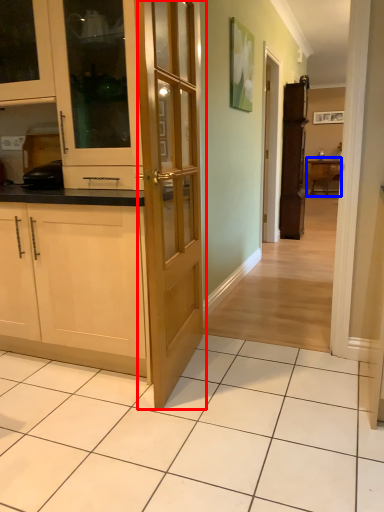
Question: Which point is further to the camera, door (highlighted by a red box) or table (highlighted by a blue box)?

Choices:
 (A) door
 (B) table

Answer: (B)